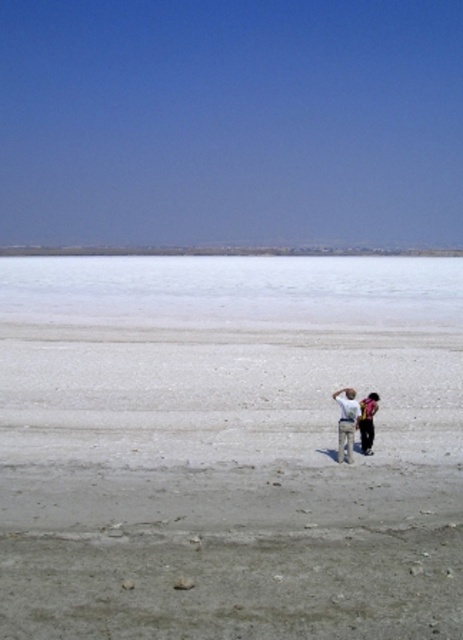
You are standing on the gray sandy dirt field at center and want to walk to the dark brown leather jacket at lower right. Which direction should you head?

The gray sandy dirt field at center is located below the dark brown leather jacket at lower right, so you should walk upwards to reach it.

You are standing on the salt flat and see two points marked in the image. Which point, point (51, 260) or point (362, 413), is closer to you?

Point (51, 260) is closer to you because it is further to the viewer than point (362, 413).

You are standing in the vast salt flat landscape and see two points marked on the ground. The first point is at coordinates point (407, 394) and the second point is at point (288, 262). Which point is closer to you?

Point (407, 394) is closer to the camera than point (288, 262), so the first point is closer to you.